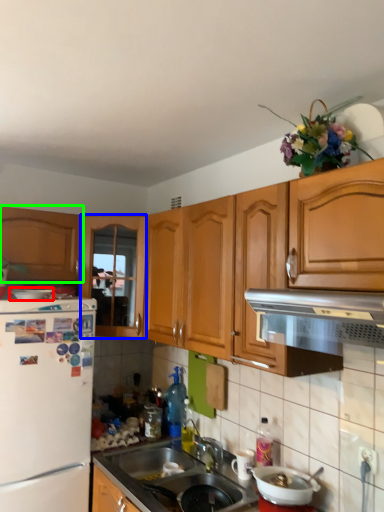
Question: Estimate the real-world distances between objects in this image. Which object is closer to appliance (highlighted by a red box), cabinetry (highlighted by a blue box) or cabinetry (highlighted by a green box)?

Choices:
 (A) cabinetry
 (B) cabinetry

Answer: (B)